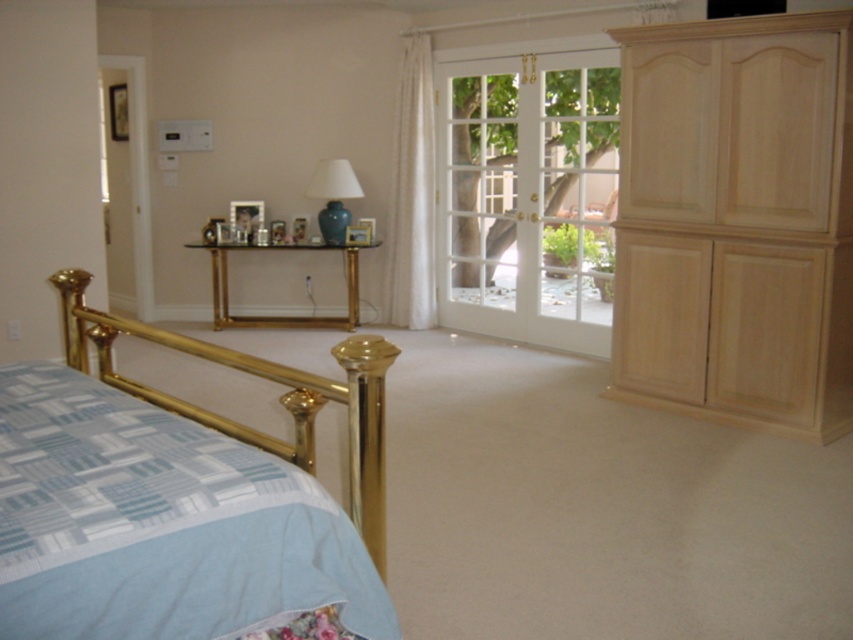
You are moving a large painting that is 1.5 meters wide into this bedroom. You need to choose between placing it on the light wood dresser at right or hanging it above the white glass screen door at upper left. Based on the dimensions provided, which location can accommodate the painting without it overhanging the edges?

The light wood dresser at right has a larger width than the white glass screen door at upper left. Since the painting is 1.5 meters wide, it can be placed on the light wood dresser at right if its width is sufficient. However, without specific measurements, we can only conclude that the dresser is wider than the door. If the dresser is wide enough to fit the painting, it would be the better choice.

You are standing in the bedroom and want to place a new painting on the wall between the gold polished metal bed at lower left and the light wood dresser at right. Based on their positions, where should you place the painting so it hangs above the bed but below the dresser?

The gold polished metal bed at lower left is positioned under the light wood dresser at right, so placing the painting above the bed but below the dresser would position it between them on the wall.